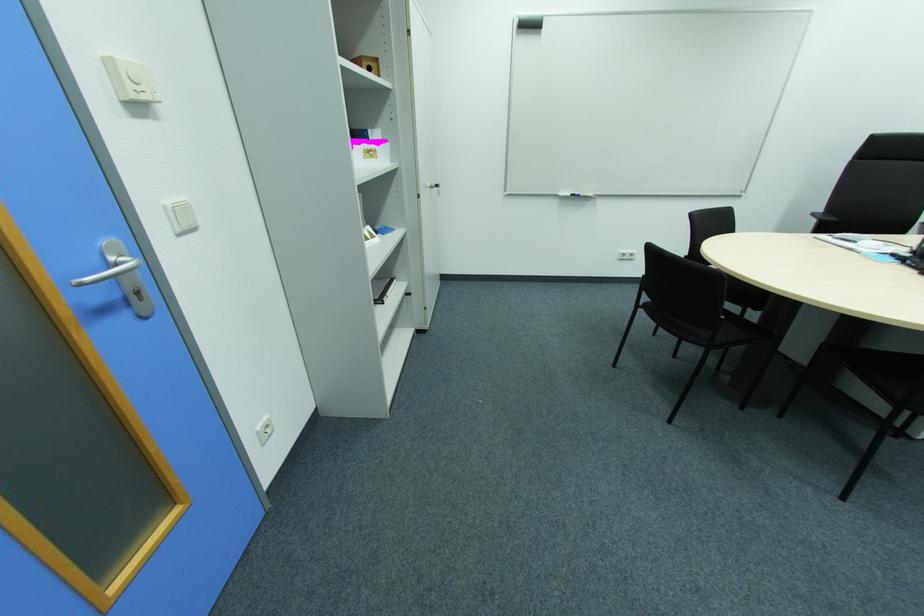
The image size is (924, 616). What do you see at coordinates (370, 151) in the screenshot?
I see `a pink and white box` at bounding box center [370, 151].